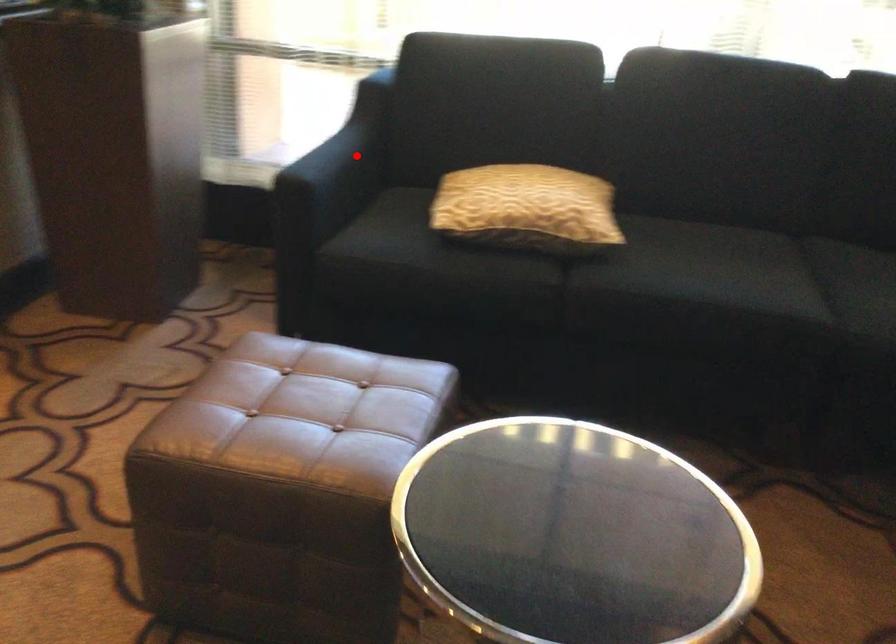
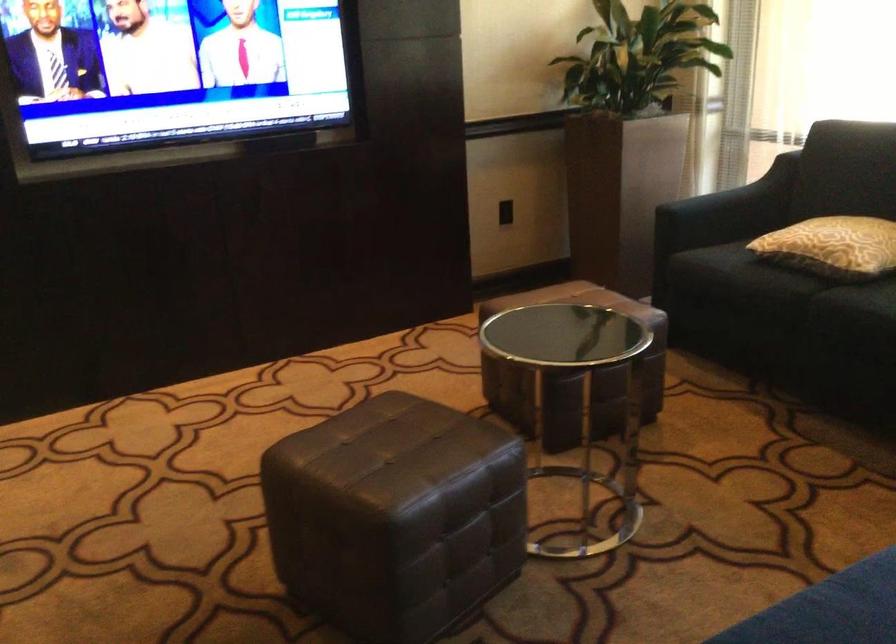
Question: I am providing you with two images of the same scene from different viewpoints. In image1, a red point is highlighted. Considering the same 3D point in image2, which of the following is correct?

Choices:
 (A) It is closer
 (B) It is farther

Answer: (B)